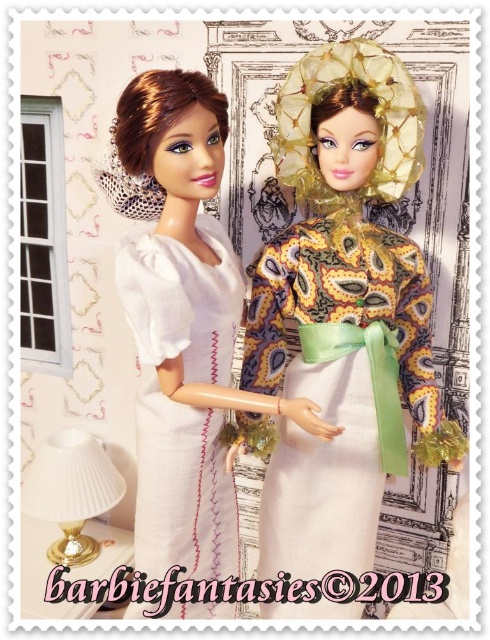
Who is positioned more to the left, matte green fabric dress at center or white pleated lampshade at lower left?

white pleated lampshade at lower left is more to the left.

From the picture: Between matte green fabric dress at center and white pleated lampshade at lower left, which one has less height?

white pleated lampshade at lower left is shorter.

Measure the distance between point (x=376, y=108) and camera.

Point (x=376, y=108) and camera are 3.80 feet apart from each other.

Find the location of a particular element. matte green fabric dress at center is located at coordinates (343, 310).

Based on the photo, does matte green fabric dress at center appear over white fabric dress at left?

Yes.

Does point (325, 273) come closer to viewer compared to point (139, 454)?

That is False.

Who is more forward, (300, 532) or (204, 276)?

Point (204, 276) is in front.

You are a GUI agent. You are given a task and a screenshot of the screen. Output one action in this format:
    pyautogui.click(x=<x>, y=<y>)
    Task: Click on the matte green fabric dress at center
    The height and width of the screenshot is (640, 490).
    Given the screenshot: What is the action you would take?
    [343, 310]

Can you confirm if white linen dress at left is positioned above white pleated lampshade at lower left?

Indeed, white linen dress at left is positioned over white pleated lampshade at lower left.

Who is more forward, (166, 474) or (87, 456)?

Positioned in front is point (166, 474).

Locate an element on the screen. white linen dress at left is located at coordinates (181, 403).